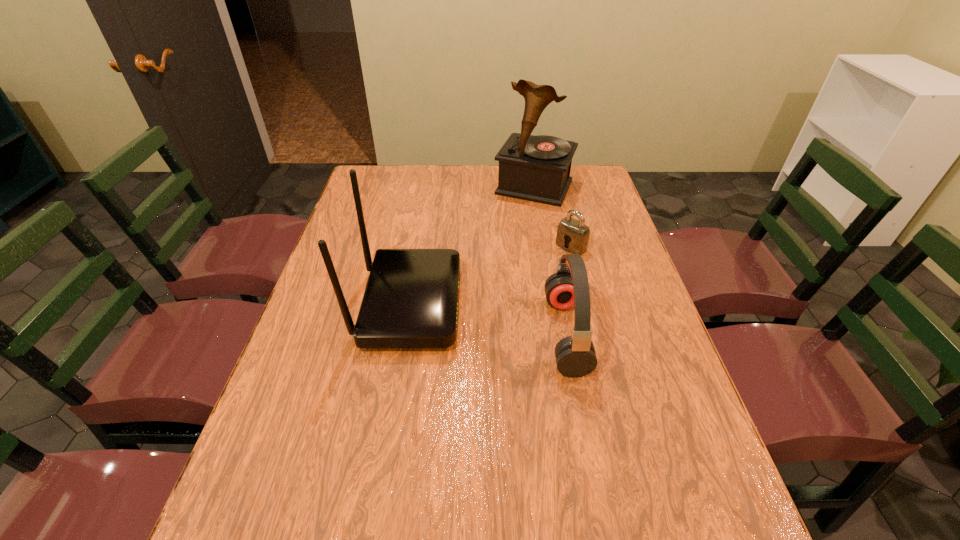
Where is `router`? router is located at coordinates (411, 298).

Find the location of a particular element. The width and height of the screenshot is (960, 540). the leftmost object is located at coordinates (411, 298).

Locate an element on the screen. The height and width of the screenshot is (540, 960). the second shortest object is located at coordinates (575, 355).

I want to click on the shortest object, so click(573, 235).

This screenshot has height=540, width=960. What are the coordinates of `padlock` in the screenshot? It's located at (573, 235).

This screenshot has width=960, height=540. In order to click on phonograph_record in this screenshot , I will do `click(537, 168)`.

In order to click on the tallest object in this screenshot , I will do `click(537, 168)`.

This screenshot has height=540, width=960. Identify the location of vacant region located on the front-facing side of the third shortest object. (481, 304).

You are a GUI agent. You are given a task and a screenshot of the screen. Output one action in this format:
    pyautogui.click(x=<x>, y=<y>)
    Task: Click on the free space located 0.150m on the ear cups of the second shortest object
    The image size is (960, 540).
    Given the screenshot: What is the action you would take?
    pyautogui.click(x=644, y=334)

You are a GUI agent. You are given a task and a screenshot of the screen. Output one action in this format:
    pyautogui.click(x=<x>, y=<y>)
    Task: Click on the free space located 0.370m at the front of the shortest object near the keyhole
    The image size is (960, 540).
    Given the screenshot: What is the action you would take?
    pyautogui.click(x=476, y=318)